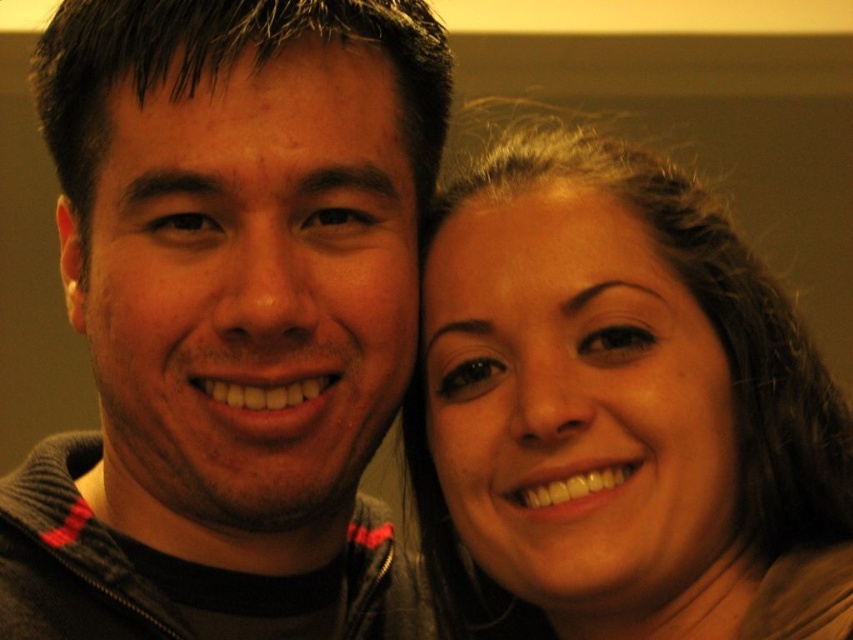
You are a photographer trying to capture a closeup shot of the matte brown hair at right without including the matte black jacket at left in the frame. Based on their positions, can you adjust your camera angle to achieve this?

The matte black jacket at left is positioned on the left side of matte brown hair at right, so by moving the camera to the right side of the matte brown hair at right and framing the shot to exclude the left side, you can capture the matte brown hair at right without including the matte black jacket at left.

You are a photographer setting up a camera at point 0.5, 0.5. You want to focus on the matte black jacket at left. Is the jacket within the camera frame?

The matte black jacket at left is at point (228, 317), which is very close to the camera position at (426, 320). Therefore, the jacket is within the camera frame.